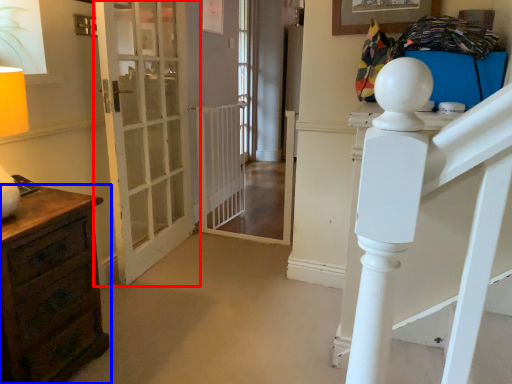
Question: Which point is closer to the camera, door (highlighted by a red box) or chest of drawers (highlighted by a blue box)?

Choices:
 (A) door
 (B) chest of drawers

Answer: (B)